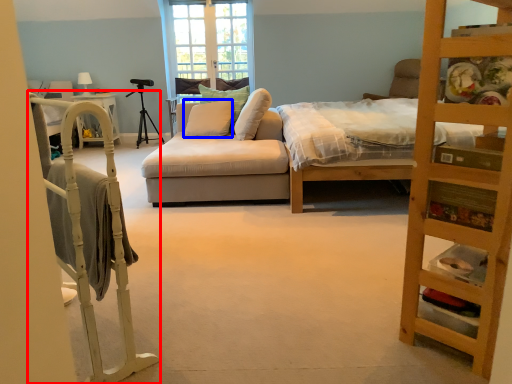
Question: Among these objects, which one is farthest to the camera, bunk bed (highlighted by a red box) or pillow (highlighted by a blue box)?

Choices:
 (A) bunk bed
 (B) pillow

Answer: (B)